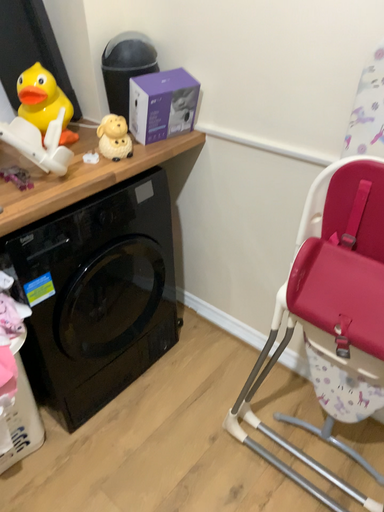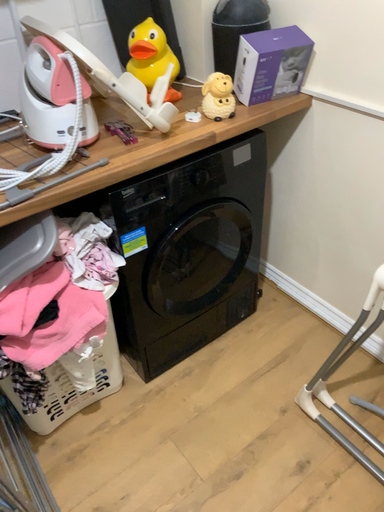
Question: How did the camera likely rotate when shooting the video?

Choices:
 (A) rotated right
 (B) rotated left

Answer: (B)